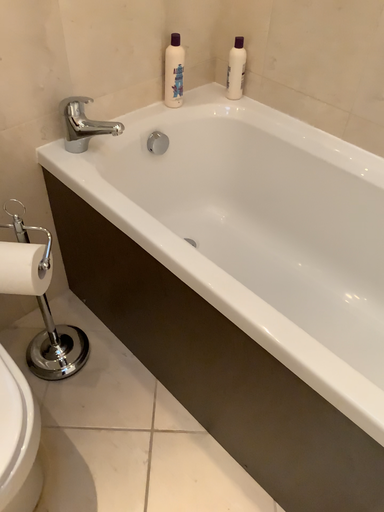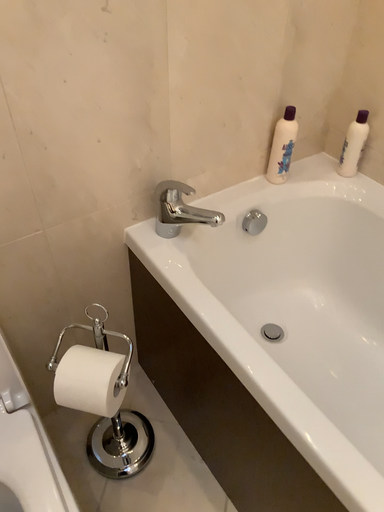
Question: How did the camera likely rotate when shooting the video?

Choices:
 (A) rotated right
 (B) rotated left

Answer: (B)